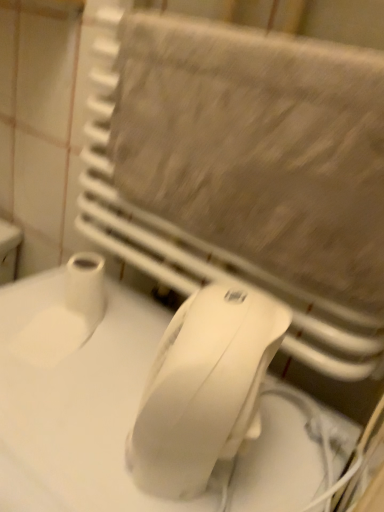
The height and width of the screenshot is (512, 384). What are the coordinates of `free space in front of white matte toilet paper at lower left` in the screenshot? It's located at (62, 370).